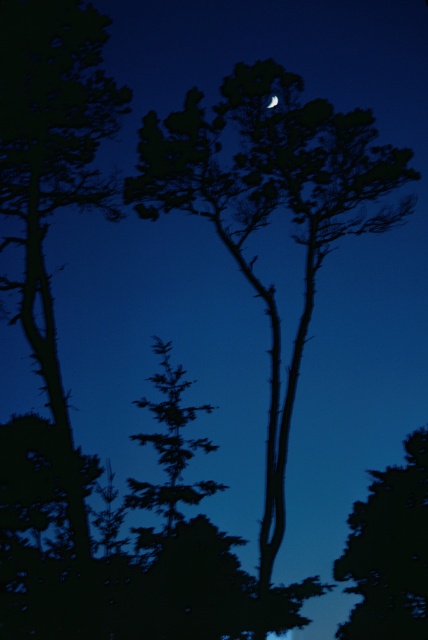
Between point (56, 131) and point (276, 104), which one is positioned in front?

Point (56, 131) is in front.

What do you see at coordinates (53, 172) in the screenshot? This screenshot has width=428, height=640. I see `dark green leafy tree at left` at bounding box center [53, 172].

What are the coordinates of `dark green leafy tree at left` in the screenshot? It's located at (53, 172).

The width and height of the screenshot is (428, 640). Describe the element at coordinates (389, 552) in the screenshot. I see `silhouette bark tree at right` at that location.

Measure the distance from silhouette bark tree at right to silvery reflective moon at upper center.

They are 59.46 feet apart.

Image resolution: width=428 pixels, height=640 pixels. Describe the element at coordinates (389, 552) in the screenshot. I see `silhouette bark tree at right` at that location.

This screenshot has height=640, width=428. Identify the location of silhouette bark tree at right. (389, 552).

Consider the image. Can you confirm if dark green leafy tree at left is smaller than silhouette bark tree at right?

No, dark green leafy tree at left is not smaller than silhouette bark tree at right.

Is point (89, 90) farther from camera compared to point (356, 515)?

No, (89, 90) is closer to viewer.

Image resolution: width=428 pixels, height=640 pixels. What are the coordinates of `dark green leafy tree at left` in the screenshot? It's located at (53, 172).